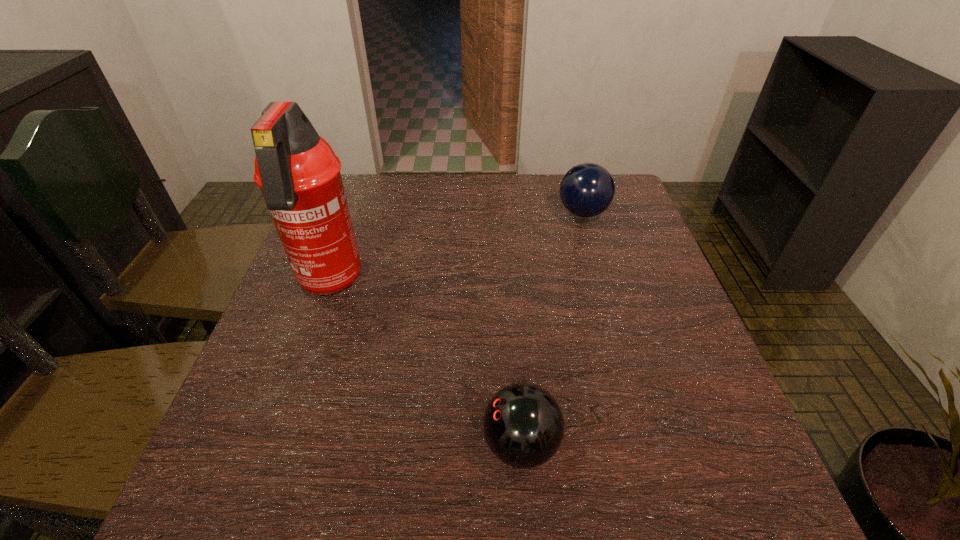
The image size is (960, 540). Find the location of `free space between the nearest object and the rightmost object`. free space between the nearest object and the rightmost object is located at coordinates (552, 328).

Identify the location of vacant point located between the second object from left to right and the farthest object. (552, 328).

Where is `vacant area that lies between the farthest object and the fire extinguisher`? The image size is (960, 540). vacant area that lies between the farthest object and the fire extinguisher is located at coordinates (456, 248).

Locate an element on the screen. The width and height of the screenshot is (960, 540). free space between the fire extinguisher and the right bowling ball is located at coordinates (456, 248).

Find the location of a particular element. free space between the nearer bowling ball and the second farthest object is located at coordinates (424, 363).

This screenshot has height=540, width=960. Identify the location of vacant space in between the nearest object and the second nearest object. 424,363.

Identify which object is the second closest to the rightmost object. Please provide its 2D coordinates. Your answer should be formatted as a tuple, i.e. [(x, y)], where the tuple contains the x and y coordinates of a point satisfying the conditions above.

[(523, 425)]

Where is `object that can be found as the closest to the left bowling ball`? Image resolution: width=960 pixels, height=540 pixels. object that can be found as the closest to the left bowling ball is located at coordinates (299, 175).

Locate an element on the screen. Image resolution: width=960 pixels, height=540 pixels. vacant space that satisfies the following two spatial constraints: 1. on the surface of the farther bowling ball near the finger holes; 2. on the trigger side of the tallest object is located at coordinates (604, 283).

The height and width of the screenshot is (540, 960). What are the coordinates of `free space that satisfies the following two spatial constraints: 1. on the surface of the rightmost object near the finger holes; 2. on the trigger side of the fire extinguisher` in the screenshot? It's located at (604, 283).